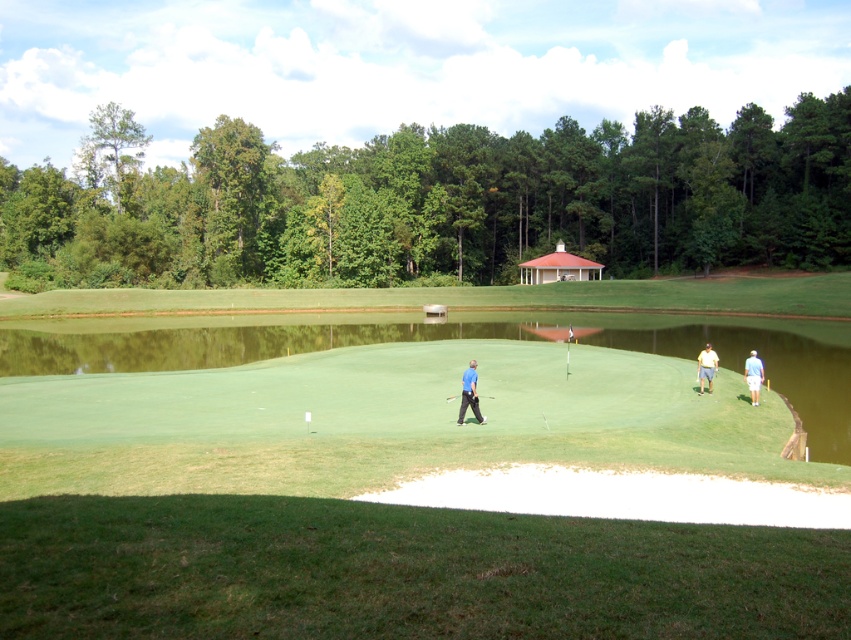
Does blue fabric shirt at center have a larger size compared to white cotton shirt at lower right?

Incorrect, blue fabric shirt at center is not larger than white cotton shirt at lower right.

Does blue fabric shirt at center have a lesser width compared to white cotton shirt at lower right?

Yes.

Measure the distance between blue fabric shirt at center and camera.

The distance of blue fabric shirt at center from camera is 18.34 meters.

Locate an element on the screen. This screenshot has height=640, width=851. blue fabric shirt at center is located at coordinates (469, 394).

Can you confirm if blue fabric shirt at center is smaller than yellow cotton shirt at right?

Indeed, blue fabric shirt at center has a smaller size compared to yellow cotton shirt at right.

Does blue fabric shirt at center have a greater width compared to yellow cotton shirt at right?

No, blue fabric shirt at center is not wider than yellow cotton shirt at right.

Which is behind, point (464, 380) or point (706, 353)?

The point (706, 353) is behind.

Locate an element on the screen. This screenshot has width=851, height=640. blue fabric shirt at center is located at coordinates (469, 394).

Is green smooth turf at center bigger than black rubber golf club at center?

Yes, green smooth turf at center is bigger than black rubber golf club at center.

In the scene shown: Does green smooth turf at center have a greater width compared to black rubber golf club at center?

Yes.

This screenshot has height=640, width=851. Describe the element at coordinates (400, 474) in the screenshot. I see `green smooth turf at center` at that location.

Where is `green smooth turf at center`? This screenshot has width=851, height=640. green smooth turf at center is located at coordinates (400, 474).